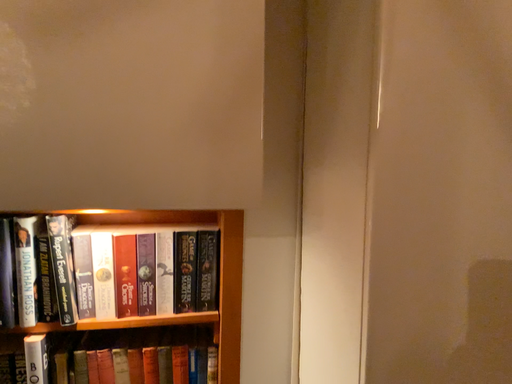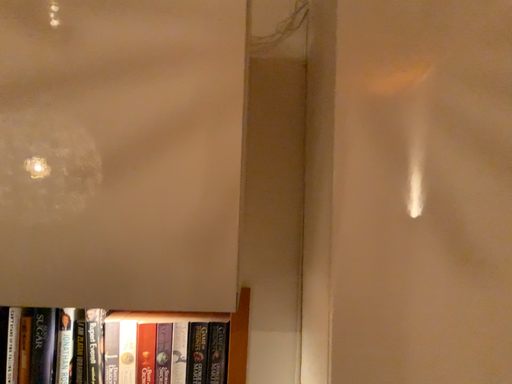
Question: How did the camera likely rotate when shooting the video?

Choices:
 (A) rotated left
 (B) rotated right

Answer: (A)